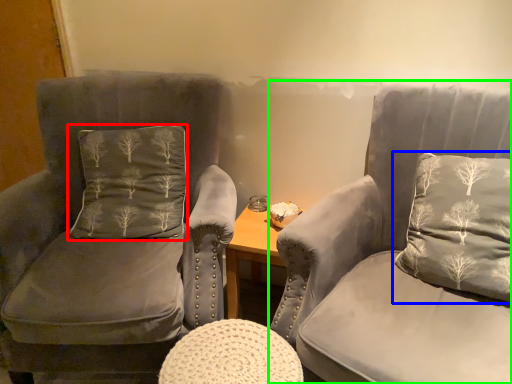
Question: Considering the real-world distances, which object is closest to pillow (highlighted by a red box)? pillow (highlighted by a blue box) or chair (highlighted by a green box).

Choices:
 (A) pillow
 (B) chair

Answer: (B)